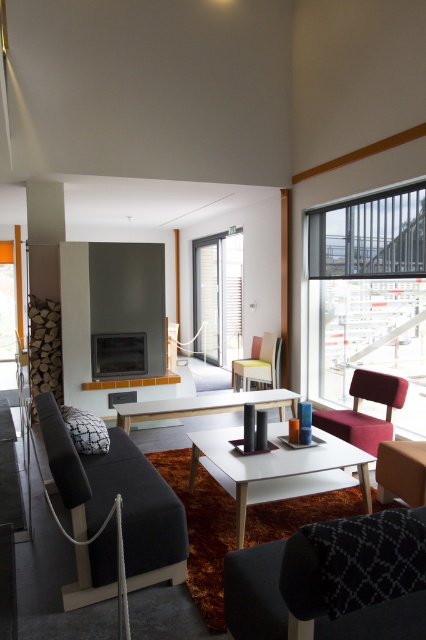
Question: Considering the real-world distances, which object is farthest from the yellow fabric armchair at center?

Choices:
 (A) dark gray fabric couch at lower left
 (B) matte gray window at center

Answer: (A)

Question: From the image, what is the correct spatial relationship of white glossy table at center in relation to matte gray window at center?

Choices:
 (A) below
 (B) above

Answer: (A)

Question: Considering the real-world distances, which object is farthest from the matte black fireplace at center?

Choices:
 (A) velvet pink armchair at right
 (B) yellow fabric armchair at center

Answer: (A)

Question: Does dark gray fabric couch at lower left appear under matte gray window at center?

Choices:
 (A) no
 (B) yes

Answer: (B)

Question: Can you confirm if transparent glass window at upper right is smaller than white wooden table at center?

Choices:
 (A) yes
 (B) no

Answer: (B)

Question: Which point is farther from the camera taking this photo?

Choices:
 (A) (273, 380)
 (B) (422, 241)
 (C) (224, 464)
 (D) (359, 422)

Answer: (A)